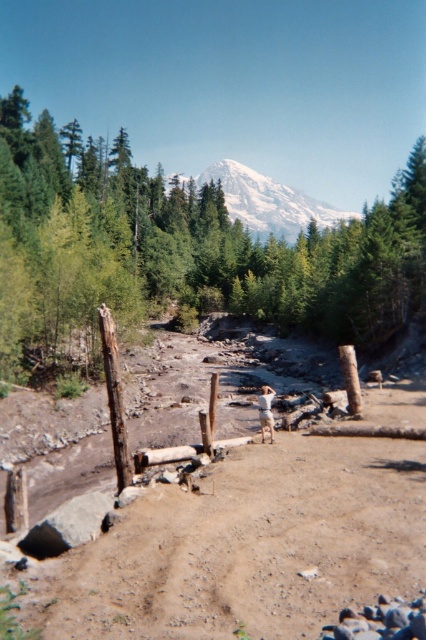
Question: Is brown sandy dirt field at center thinner than snowy white mountain at center?

Choices:
 (A) yes
 (B) no

Answer: (A)

Question: Is brown sandy dirt field at center positioned at the back of snowy white mountain at center?

Choices:
 (A) yes
 (B) no

Answer: (B)

Question: Which object appears closest to the camera in this image?

Choices:
 (A) green leafy tree at center
 (B) snowy white mountain at center

Answer: (A)

Question: Which of the following is the closest to the observer?

Choices:
 (A) snowy white mountain at center
 (B) green leafy tree at center

Answer: (B)

Question: Can you confirm if brown sandy dirt field at center is positioned above snowy white mountain at center?

Choices:
 (A) yes
 (B) no

Answer: (B)

Question: Based on their relative distances, which object is nearer to the snowy white mountain at center?

Choices:
 (A) green leafy tree at center
 (B) brown sandy dirt field at center

Answer: (A)